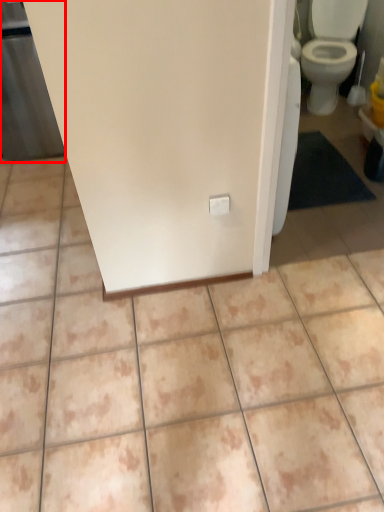
Question: From the image's perspective, where is screen door (annotated by the red box) located in relation to ceramic tile in the image?

Choices:
 (A) above
 (B) below

Answer: (A)